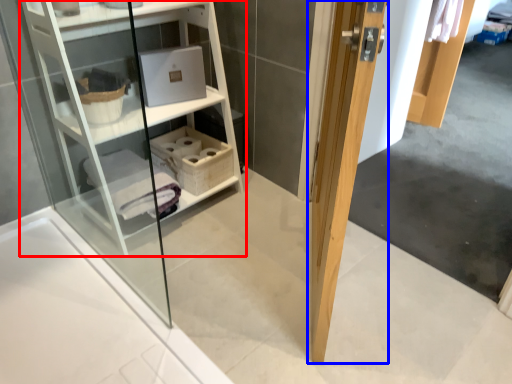
Question: Which object is closer to the camera taking this photo, shelf (highlighted by a red box) or door (highlighted by a blue box)?

Choices:
 (A) shelf
 (B) door

Answer: (B)